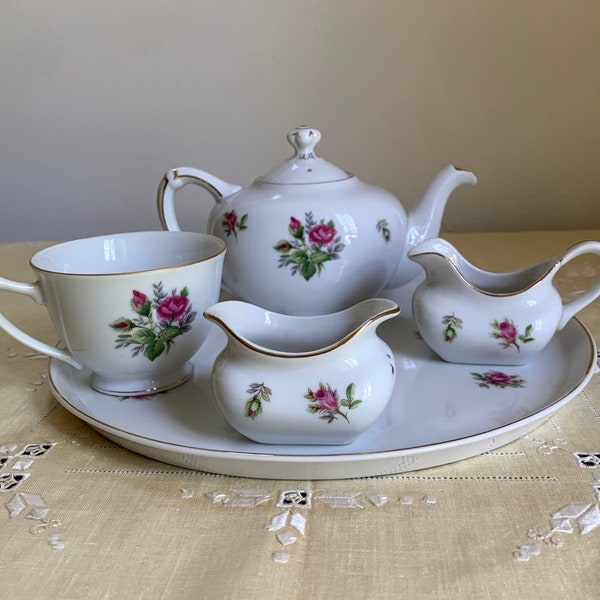
Identify the location of cup. The image size is (600, 600). (92, 314).